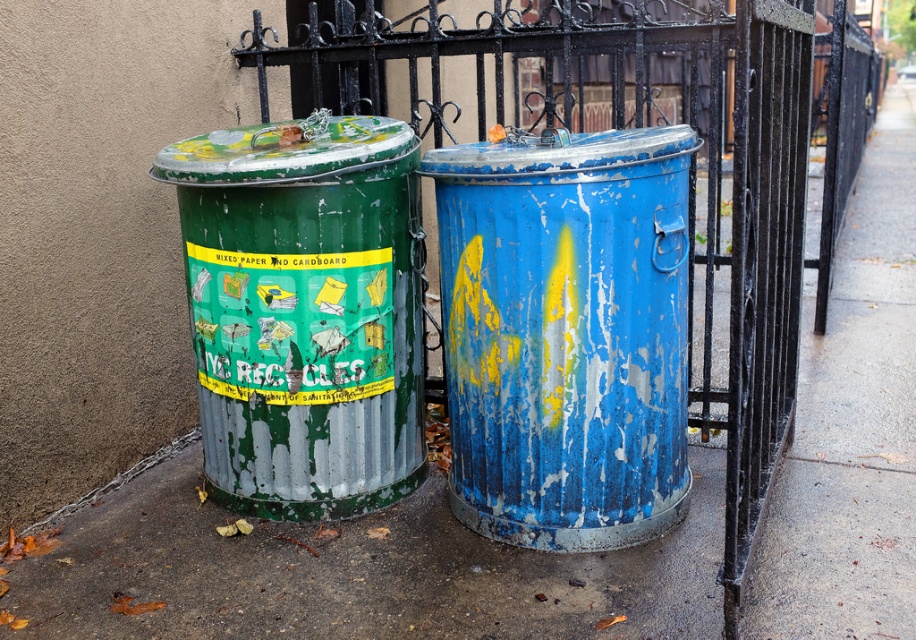
How much distance is there between rusty metal trash can at center and green corrugated metal recycling bin at left?

19.99 inches

Between point (613, 499) and point (358, 170), which one is positioned in front?

Positioned in front is point (358, 170).

Which is behind, point (680, 436) or point (349, 177)?

Positioned behind is point (680, 436).

Identify the location of rusty metal trash can at center. (566, 333).

Who is lower down, brushed metal fence at center or green corrugated metal recycling bin at left?

green corrugated metal recycling bin at left is below.

What do you see at coordinates (687, 163) in the screenshot? The image size is (916, 640). I see `brushed metal fence at center` at bounding box center [687, 163].

Where is `brushed metal fence at center`? The width and height of the screenshot is (916, 640). brushed metal fence at center is located at coordinates (687, 163).

Is brushed metal fence at center to the left of rusty metal trash can at center from the viewer's perspective?

In fact, brushed metal fence at center is to the right of rusty metal trash can at center.

Can you confirm if brushed metal fence at center is positioned below rusty metal trash can at center?

No.

Is point (745, 134) more distant than point (647, 301)?

That is False.

Image resolution: width=916 pixels, height=640 pixels. I want to click on brushed metal fence at center, so click(x=687, y=163).